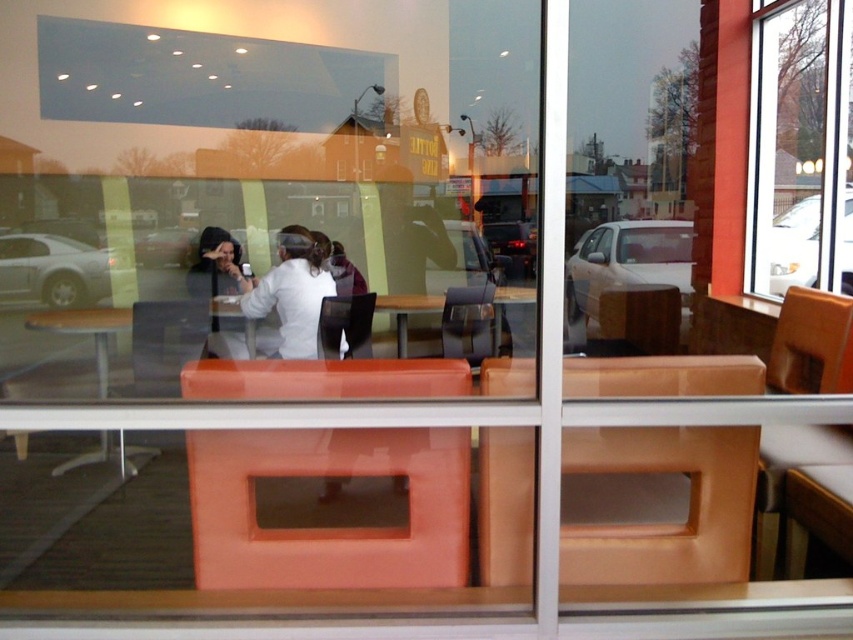
Is transparent glass window at upper right positioned at the back of white matte shirt at center?

Yes, it is behind white matte shirt at center.

Is point (755, 234) farther from viewer compared to point (288, 296)?

That is True.

Find the location of a particular element. The image size is (853, 640). transparent glass window at upper right is located at coordinates 802,148.